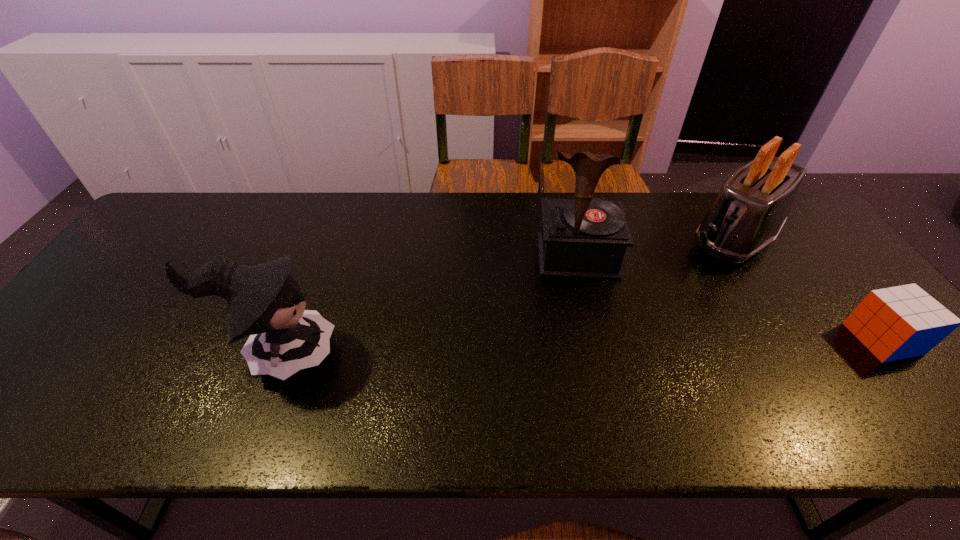
Image resolution: width=960 pixels, height=540 pixels. Identify the location of free point located 0.070m on the side of the toaster with the control lever. (698, 272).

Locate an element on the screen. vacant space situated on the side of the toaster with the control lever is located at coordinates (652, 315).

Image resolution: width=960 pixels, height=540 pixels. Find the location of `phonograph_record that is at the far edge`. phonograph_record that is at the far edge is located at coordinates (582, 238).

Identify the location of toaster that is at the far edge. The image size is (960, 540). (752, 207).

Image resolution: width=960 pixels, height=540 pixels. In order to click on doll that is at the near edge in this screenshot , I will do `click(264, 301)`.

I want to click on cube that is at the near edge, so click(894, 323).

Locate an element on the screen. The height and width of the screenshot is (540, 960). cube situated at the right edge is located at coordinates (894, 323).

I want to click on toaster that is at the right edge, so click(x=752, y=207).

This screenshot has height=540, width=960. In order to click on object that is at the far right corner in this screenshot , I will do `click(752, 207)`.

This screenshot has width=960, height=540. I want to click on object present at the near right corner, so click(894, 323).